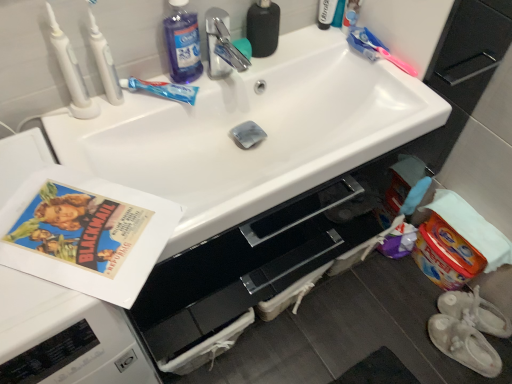
Question: Is the position of translucent blue toothpaste at upper center, placed as the second toothbrush when sorted from right to left, less distant than that of white glossy sink at center?

Choices:
 (A) yes
 (B) no

Answer: (B)

Question: Is translucent blue toothpaste at upper center, which is counted as the third toothbrush, starting from the left, positioned far away from white glossy sink at center?

Choices:
 (A) yes
 (B) no

Answer: (B)

Question: From the image's perspective, would you say translucent blue toothpaste at upper center, which is counted as the third toothbrush, starting from the left, is shown under white glossy sink at center?

Choices:
 (A) yes
 (B) no

Answer: (B)

Question: Can you confirm if translucent blue toothpaste at upper center, placed as the second toothbrush when sorted from right to left, is thinner than white glossy sink at center?

Choices:
 (A) no
 (B) yes

Answer: (B)

Question: Would you say translucent blue toothpaste at upper center, placed as the second toothbrush when sorted from right to left, is outside white glossy sink at center?

Choices:
 (A) no
 (B) yes

Answer: (B)

Question: Choose the correct answer: Is pink plastic toothbrush at upper right, the 1th toothbrush viewed from the right, inside vintage paper at left or outside it?

Choices:
 (A) inside
 (B) outside

Answer: (B)

Question: From a real-world perspective, relative to vintage paper at left, is pink plastic toothbrush at upper right, which is the fourth toothbrush from left to right, vertically above or below?

Choices:
 (A) above
 (B) below

Answer: (A)

Question: From the image's perspective, is pink plastic toothbrush at upper right, the 1th toothbrush viewed from the right, above or below vintage paper at left?

Choices:
 (A) above
 (B) below

Answer: (A)

Question: In terms of width, does pink plastic toothbrush at upper right, the 1th toothbrush viewed from the right, look wider or thinner when compared to vintage paper at left?

Choices:
 (A) wide
 (B) thin

Answer: (B)

Question: Looking at their shapes, would you say white plastic toothbrush at upper left, arranged as the fourth toothbrush when viewed from the right, is wider or thinner than pink plastic toothbrush at upper right, which is the fourth toothbrush from left to right?

Choices:
 (A) thin
 (B) wide

Answer: (B)

Question: Is point (68, 74) closer or farther from the camera than point (353, 46)?

Choices:
 (A) farther
 (B) closer

Answer: (B)

Question: Considering their positions, is white plastic toothbrush at upper left, which ranks as the first toothbrush in left-to-right order, located in front of or behind pink plastic toothbrush at upper right, the 1th toothbrush viewed from the right?

Choices:
 (A) front
 (B) behind

Answer: (A)

Question: From a real-world perspective, is white plastic toothbrush at upper left, arranged as the fourth toothbrush when viewed from the right, above or below pink plastic toothbrush at upper right, which is the fourth toothbrush from left to right?

Choices:
 (A) below
 (B) above

Answer: (B)

Question: In the image, is blue liquid at upper left positioned in front of or behind pink plastic toothbrush at upper right, which is the fourth toothbrush from left to right?

Choices:
 (A) front
 (B) behind

Answer: (A)

Question: From their relative heights in the image, would you say blue liquid at upper left is taller or shorter than pink plastic toothbrush at upper right, which is the fourth toothbrush from left to right?

Choices:
 (A) short
 (B) tall

Answer: (B)